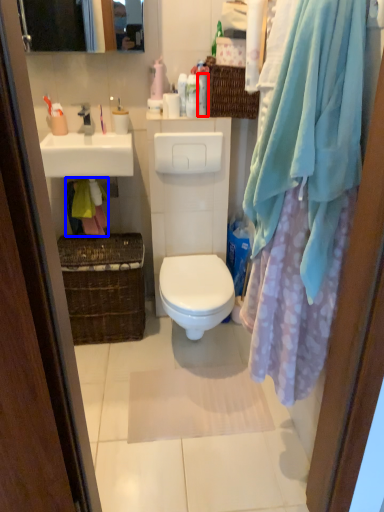
Question: Which object appears closest to the camera in this image, toiletry (highlighted by a red box) or material (highlighted by a blue box)?

Choices:
 (A) toiletry
 (B) material

Answer: (A)